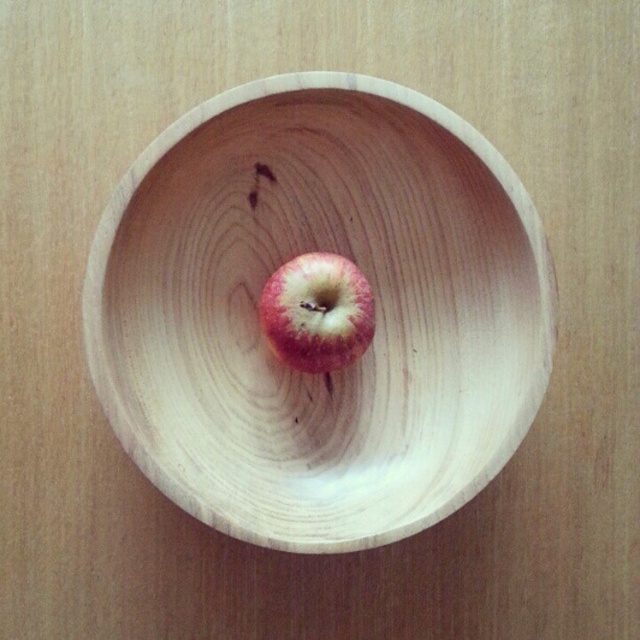
Question: Which point appears farthest from the camera in this image?

Choices:
 (A) (400, 300)
 (B) (291, 298)

Answer: (A)

Question: Which point appears farthest from the camera in this image?

Choices:
 (A) (324, 336)
 (B) (244, 458)

Answer: (B)

Question: Is natural wood bowl at center above red matte apple at center?

Choices:
 (A) no
 (B) yes

Answer: (A)

Question: Can you confirm if natural wood bowl at center is positioned to the right of red matte apple at center?

Choices:
 (A) no
 (B) yes

Answer: (B)

Question: Can you confirm if natural wood bowl at center is wider than red matte apple at center?

Choices:
 (A) no
 (B) yes

Answer: (B)

Question: Which point is closer to the camera?

Choices:
 (A) natural wood bowl at center
 (B) red matte apple at center

Answer: (A)